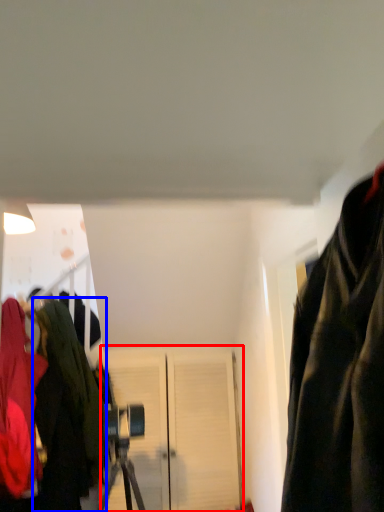
Question: Which object is further to the camera taking this photo, door (highlighted by a red box) or jacket (highlighted by a blue box)?

Choices:
 (A) door
 (B) jacket

Answer: (A)